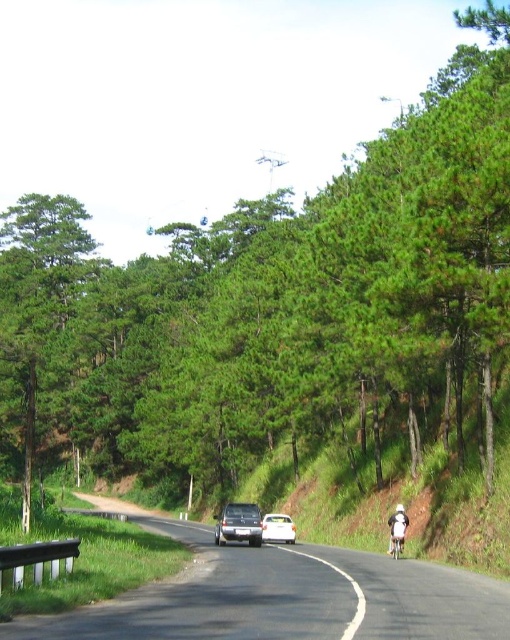
You are a cyclist approaching the curve on the black asphalt road at center. You see the satin silver sedan at center ahead of you. Is there enough space to safely pass the sedan before the curve?

The distance between the black asphalt road at center and the satin silver sedan at center is 7.60 meters. However, the question mentions the sedan is on the road, so the distance might refer to the road length ahead. To safely pass, cyclists need at least 10 meters of clear space. Since 7.60 meters is less than 10 meters, there isn not enough space to safely pass the sedan before the curve.

You are a driver approaching a scenic road with a cyclist ahead. The road is bordered by a guardrail on the left. You see the black asphalt road at center and the green matte tree at left. Which object is wider?

The black asphalt road at center is narrower than the green matte tree at left, so the green matte tree at left is wider.

You are a driver approaching the white glossy car at center on the scenic road. You notice a green matte tree at left nearby. Which object is taller when viewed from your perspective?

The green matte tree at left is much taller than the white glossy car at center, so the tree appears taller when viewed from your perspective.